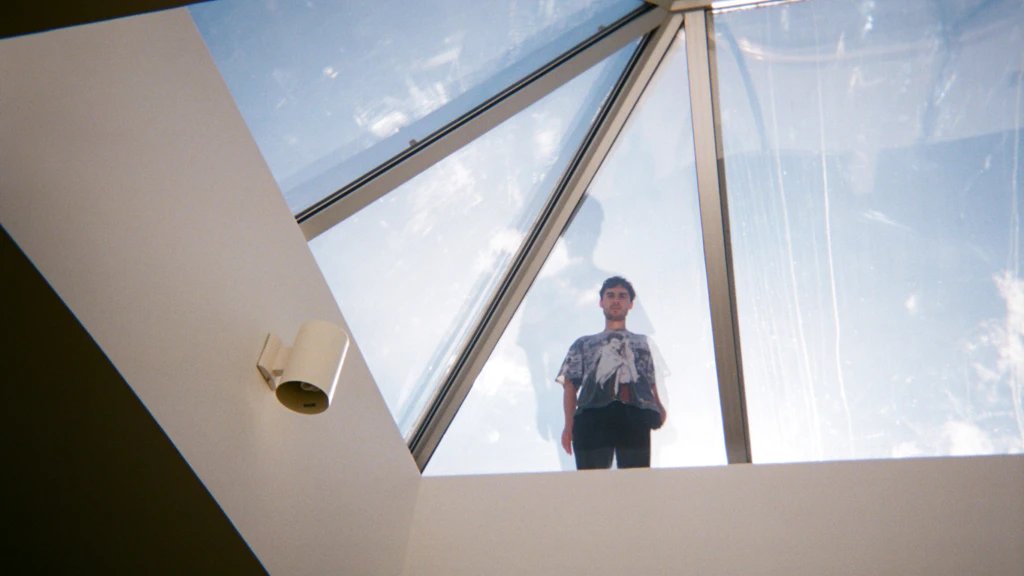
Where is `ceiling`? ceiling is located at coordinates (108, 492).